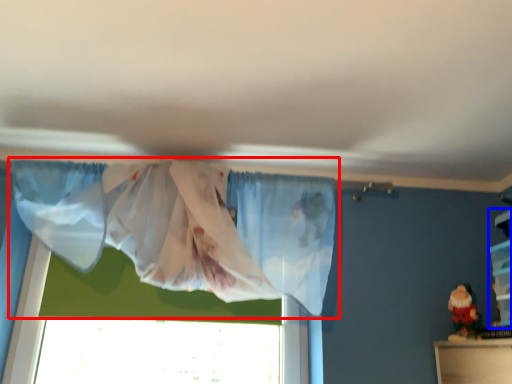
Question: Which object appears farthest to the camera in this image, curtain (highlighted by a red box) or shelf (highlighted by a blue box)?

Choices:
 (A) curtain
 (B) shelf

Answer: (B)